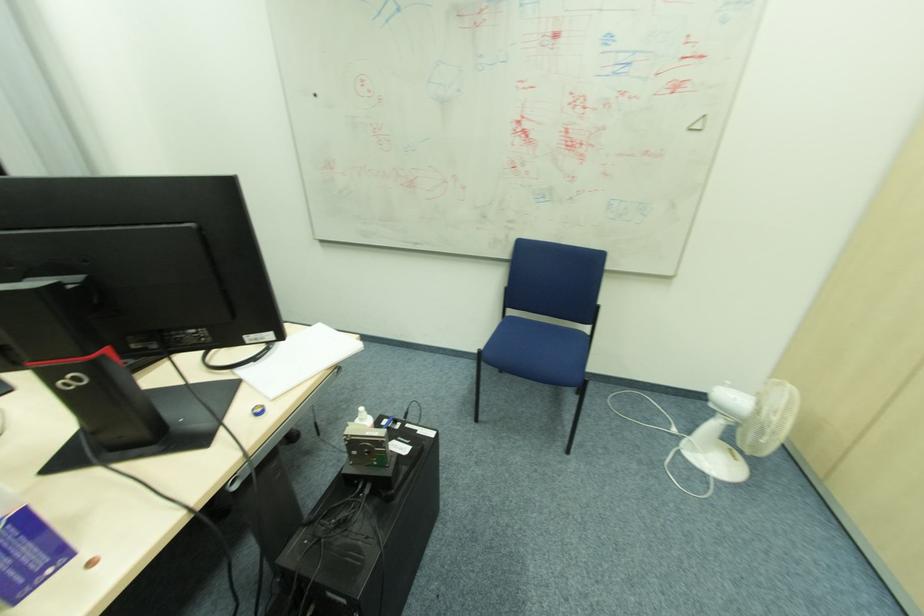
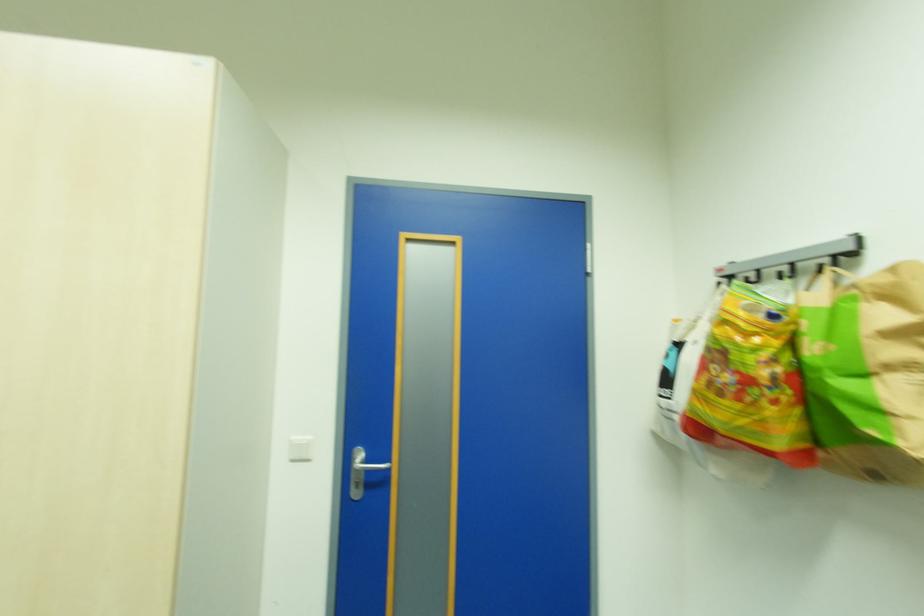
Question: The first image is from the beginning of the video and the second image is from the end. How did the camera likely rotate when shooting the video?

Choices:
 (A) Left
 (B) Right
 (C) Up
 (D) Down

Answer: (B)